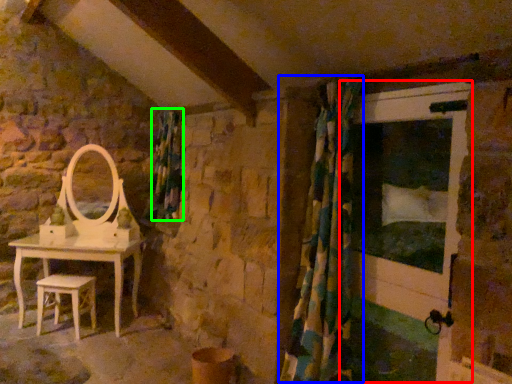
Question: Based on their relative distances, which object is farther from screen door (highlighted by a red box)? Choose from shower curtain (highlighted by a blue box) and curtain (highlighted by a green box).

Choices:
 (A) shower curtain
 (B) curtain

Answer: (B)